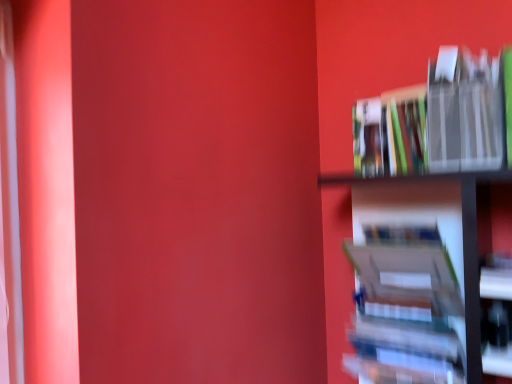
Question: Is hardcover book at right, which appears as the 1th book when ordered from the bottom, wider than metallic silver book at right, placed as the third book when sorted from bottom to top?

Choices:
 (A) yes
 (B) no

Answer: (B)

Question: Are hardcover book at right, the 3th book from the top, and metallic silver book at right, placed as the third book when sorted from bottom to top, located far from each other?

Choices:
 (A) yes
 (B) no

Answer: (B)

Question: Does hardcover book at right, which appears as the 1th book when ordered from the bottom, have a lesser height compared to metallic silver book at right, acting as the first book starting from the top?

Choices:
 (A) no
 (B) yes

Answer: (A)

Question: Is hardcover book at right, the 3th book from the top, surrounding metallic silver book at right, placed as the third book when sorted from bottom to top?

Choices:
 (A) no
 (B) yes

Answer: (A)

Question: Does hardcover book at right, the 3th book from the top, come in front of metallic silver book at right, acting as the first book starting from the top?

Choices:
 (A) yes
 (B) no

Answer: (B)

Question: Looking at their shapes, would you say metallic silver book at right, acting as the first book starting from the top, is wider or thinner than hardcover book at right, which appears as the 1th book when ordered from the bottom?

Choices:
 (A) wide
 (B) thin

Answer: (A)

Question: Is metallic silver book at right, acting as the first book starting from the top, spatially inside hardcover book at right, which appears as the 1th book when ordered from the bottom, or outside of it?

Choices:
 (A) inside
 (B) outside

Answer: (B)

Question: From a real-world perspective, relative to hardcover book at right, the 3th book from the top, is metallic silver book at right, acting as the first book starting from the top, vertically above or below?

Choices:
 (A) below
 (B) above

Answer: (B)

Question: Visually, is metallic silver book at right, placed as the third book when sorted from bottom to top, positioned to the left or to the right of hardcover book at right, which appears as the 1th book when ordered from the bottom?

Choices:
 (A) right
 (B) left

Answer: (A)

Question: Would you say metallic silver book at right, acting as the first book starting from the top, is to the left or to the right of hardcover book at upper right, placed as the 2th book when sorted from top to bottom, in the picture?

Choices:
 (A) right
 (B) left

Answer: (A)

Question: Considering the positions of metallic silver book at right, placed as the third book when sorted from bottom to top, and hardcover book at upper right, the 2th book when ordered from bottom to top, in the image, is metallic silver book at right, placed as the third book when sorted from bottom to top, taller or shorter than hardcover book at upper right, the 2th book when ordered from bottom to top,?

Choices:
 (A) tall
 (B) short

Answer: (A)

Question: Is metallic silver book at right, placed as the third book when sorted from bottom to top, bigger or smaller than hardcover book at upper right, the 2th book when ordered from bottom to top?

Choices:
 (A) big
 (B) small

Answer: (A)

Question: Is metallic silver book at right, acting as the first book starting from the top, in front of or behind hardcover book at upper right, the 2th book when ordered from bottom to top, in the image?

Choices:
 (A) behind
 (B) front

Answer: (B)

Question: Is point (358, 165) positioned closer to the camera than point (432, 77)?

Choices:
 (A) farther
 (B) closer

Answer: (A)

Question: Would you say hardcover book at upper right, placed as the 2th book when sorted from top to bottom, is to the left or to the right of metallic silver book at right, placed as the third book when sorted from bottom to top, in the picture?

Choices:
 (A) right
 (B) left

Answer: (B)